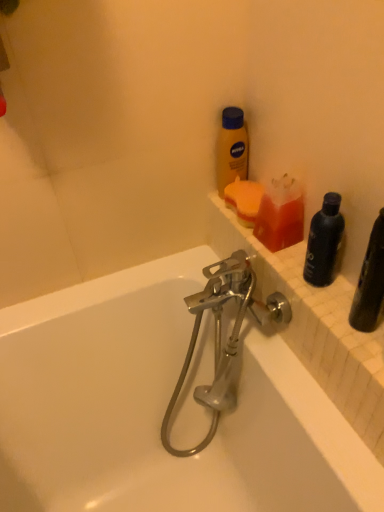
You are a GUI agent. You are given a task and a screenshot of the screen. Output one action in this format:
    pyautogui.click(x=<x>, y=<y>)
    Task: Click on the free spot above white tile ledge at upper right (from a real-world perspective)
    This screenshot has height=512, width=384.
    Given the screenshot: What is the action you would take?
    pyautogui.click(x=297, y=262)